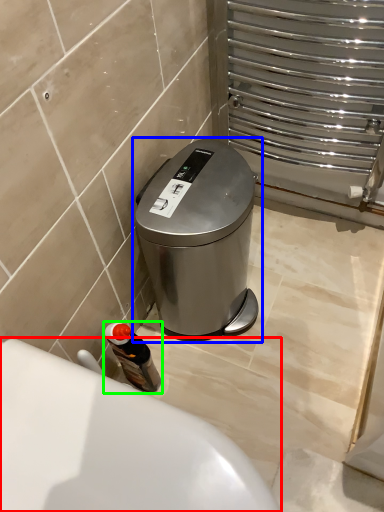
Question: Which object is positioned farthest from bath (highlighted by a red box)? Select from waste container (highlighted by a blue box) and bottle (highlighted by a green box).

Choices:
 (A) waste container
 (B) bottle

Answer: (A)